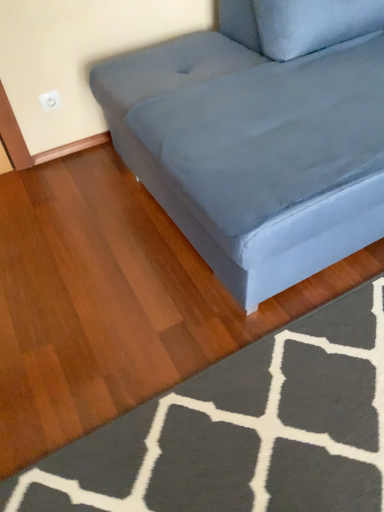
Describe the element at coordinates (242, 430) in the screenshot. I see `dark gray textured rug at lower right` at that location.

Image resolution: width=384 pixels, height=512 pixels. Find the location of `dark gray textured rug at lower right`. dark gray textured rug at lower right is located at coordinates (242, 430).

Measure the distance between point (231, 253) and camera.

Point (231, 253) and camera are 1.19 meters apart from each other.

What do you see at coordinates (260, 136) in the screenshot? I see `suede-like gray couch at center` at bounding box center [260, 136].

Measure the distance between suede-like gray couch at center and camera.

suede-like gray couch at center is 1.01 meters from camera.

Locate an element on the screen. suede-like gray couch at center is located at coordinates (260, 136).

The image size is (384, 512). I want to click on dark gray textured rug at lower right, so click(242, 430).

Based on their positions, is suede-like gray couch at center located to the left or right of dark gray textured rug at lower right?

suede-like gray couch at center is to the right of dark gray textured rug at lower right.

Considering their positions, is suede-like gray couch at center located in front of or behind dark gray textured rug at lower right?

In the image, suede-like gray couch at center appears in front of dark gray textured rug at lower right.

Does point (328, 66) lie in front of point (281, 414)?

No, it is behind (281, 414).

From the image's perspective, is suede-like gray couch at center positioned above or below dark gray textured rug at lower right?

Clearly, from the image's perspective, suede-like gray couch at center is above dark gray textured rug at lower right.

From a real-world perspective, is suede-like gray couch at center positioned over dark gray textured rug at lower right based on gravity?

Correct, in the physical world, suede-like gray couch at center is higher than dark gray textured rug at lower right.

Considering the sizes of objects suede-like gray couch at center and dark gray textured rug at lower right in the image provided, who is wider, suede-like gray couch at center or dark gray textured rug at lower right?

With larger width is suede-like gray couch at center.

Considering the sizes of suede-like gray couch at center and dark gray textured rug at lower right in the image, is suede-like gray couch at center taller or shorter than dark gray textured rug at lower right?

In the image, suede-like gray couch at center appears to be taller than dark gray textured rug at lower right.

Does suede-like gray couch at center have a larger size compared to dark gray textured rug at lower right?

Yes, suede-like gray couch at center is bigger than dark gray textured rug at lower right.

Is suede-like gray couch at center outside of dark gray textured rug at lower right?

Indeed, suede-like gray couch at center is completely outside dark gray textured rug at lower right.

Are suede-like gray couch at center and dark gray textured rug at lower right making contact?

A: No, suede-like gray couch at center is not in contact with dark gray textured rug at lower right.

Is suede-like gray couch at center aimed at dark gray textured rug at lower right?

No, suede-like gray couch at center is not aimed at dark gray textured rug at lower right.

Can you tell me how much suede-like gray couch at center and dark gray textured rug at lower right differ in facing direction?

suede-like gray couch at center and dark gray textured rug at lower right are facing 91.9 degrees away from each other.

The width and height of the screenshot is (384, 512). In order to click on studio couch on the right of dark gray textured rug at lower right in this screenshot , I will do `click(260, 136)`.

Which is more to the right, dark gray textured rug at lower right or suede-like gray couch at center?

suede-like gray couch at center.

Considering their positions, is dark gray textured rug at lower right located in front of or behind suede-like gray couch at center?

Clearly, dark gray textured rug at lower right is behind suede-like gray couch at center.

Is point (213, 406) closer or farther from the camera than point (206, 50)?

Point (213, 406).

From the image's perspective, who appears lower, dark gray textured rug at lower right or suede-like gray couch at center?

dark gray textured rug at lower right.

From a real-world perspective, is dark gray textured rug at lower right physically above suede-like gray couch at center?

No.

Which of these two, dark gray textured rug at lower right or suede-like gray couch at center, is wider?

With larger width is suede-like gray couch at center.

In terms of height, does dark gray textured rug at lower right look taller or shorter compared to suede-like gray couch at center?

dark gray textured rug at lower right is shorter than suede-like gray couch at center.

Based on their sizes in the image, would you say dark gray textured rug at lower right is bigger or smaller than suede-like gray couch at center?

dark gray textured rug at lower right is smaller than suede-like gray couch at center.

Is dark gray textured rug at lower right spatially inside suede-like gray couch at center, or outside of it?

dark gray textured rug at lower right lies outside suede-like gray couch at center.

Is dark gray textured rug at lower right placed right next to suede-like gray couch at center?

dark gray textured rug at lower right and suede-like gray couch at center are not in contact.

Is dark gray textured rug at lower right positioned with its back to suede-like gray couch at center?

No, dark gray textured rug at lower right's orientation is not away from suede-like gray couch at center.

At what (x,y) coordinates should I click in order to perform the action: click on doormat located underneath the suede-like gray couch at center (from a real-world perspective). Please return your answer as a coordinate pair (x, y). The image size is (384, 512). Looking at the image, I should click on (242, 430).

Find the location of a particular element. Image resolution: width=384 pixels, height=512 pixels. doormat beneath the suede-like gray couch at center (from a real-world perspective) is located at coordinates (242, 430).

You are a GUI agent. You are given a task and a screenshot of the screen. Output one action in this format:
    pyautogui.click(x=<x>, y=<y>)
    Task: Click on the doormat lying below the suede-like gray couch at center (from the image's perspective)
    The image size is (384, 512).
    Given the screenshot: What is the action you would take?
    242,430